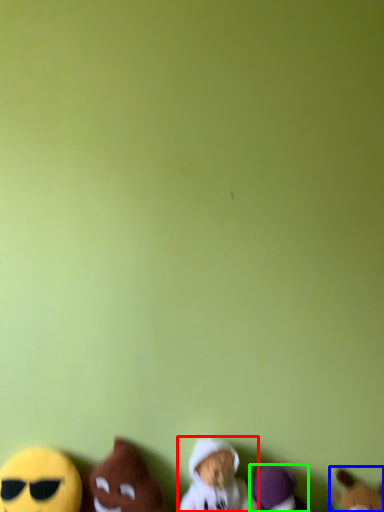
Question: Estimate the real-world distances between objects in this image. Which object is farther from toy (highlighted by a red box), toy (highlighted by a blue box) or toy (highlighted by a green box)?

Choices:
 (A) toy
 (B) toy

Answer: (A)